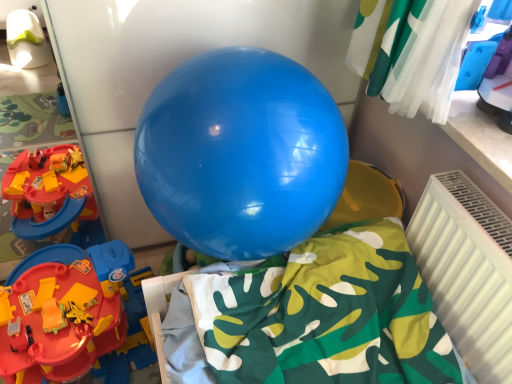
Question: In terms of height, does white plastic radiator at lower right look taller or shorter compared to glossy blue balloon at center?

Choices:
 (A) short
 (B) tall

Answer: (A)

Question: Relative to glossy blue balloon at center, is white plastic radiator at lower right in front or behind?

Choices:
 (A) behind
 (B) front

Answer: (A)

Question: Which is nearer to the glossy blue balloon at center?

Choices:
 (A) white plastic radiator at lower right
 (B) rubberized plastic track at left

Answer: (A)

Question: Which is nearer to the white plastic radiator at lower right?

Choices:
 (A) rubberized plastic track at left
 (B) glossy blue balloon at center

Answer: (B)